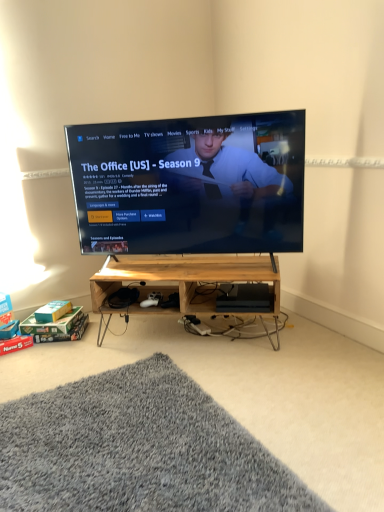
What do you see at coordinates (238, 297) in the screenshot? Image resolution: width=384 pixels, height=512 pixels. I see `wooden at center, positioned as the 2th shelf in bottom-to-top order` at bounding box center [238, 297].

Image resolution: width=384 pixels, height=512 pixels. I want to click on matte black tv at center, so pos(190,184).

What do you see at coordinates (193, 286) in the screenshot? I see `wooden at center, the 1th shelf when ordered from bottom to top` at bounding box center [193, 286].

This screenshot has height=512, width=384. I want to click on gray shaggy rug at lower left, so click(138, 449).

From a real-world perspective, which is physically below, gray shaggy rug at lower left or wooden at center, the 1th shelf when ordered from bottom to top?

→ gray shaggy rug at lower left.

Is gray shaggy rug at lower left thinner than wooden at center, placed as the second shelf when sorted from top to bottom?

Incorrect, the width of gray shaggy rug at lower left is not less than that of wooden at center, placed as the second shelf when sorted from top to bottom.

Which of these two, gray shaggy rug at lower left or wooden at center, the 1th shelf when ordered from bottom to top, is bigger?

wooden at center, the 1th shelf when ordered from bottom to top.

Which is more distant, (156, 401) or (233, 259)?

The point (233, 259) is farther from the camera.

From the image's perspective, is gray shaggy rug at lower left on wooden at center, the 1th shelf from the top?

No, from the image's perspective, gray shaggy rug at lower left is not above wooden at center, the 1th shelf from the top.

Is wooden at center, the 1th shelf from the top, at the back of gray shaggy rug at lower left?

No, wooden at center, the 1th shelf from the top, is not at the back of gray shaggy rug at lower left.

From a real-world perspective, is gray shaggy rug at lower left physically located above or below wooden at center, positioned as the 2th shelf in bottom-to-top order?

Clearly, from a real-world perspective, gray shaggy rug at lower left is below wooden at center, positioned as the 2th shelf in bottom-to-top order.

Which of these two, gray shaggy rug at lower left or wooden at center, the 1th shelf from the top, is wider?

Wider between the two is gray shaggy rug at lower left.

Which is nearer, (239, 304) or (162, 280)?

The point (239, 304) is more forward.

Is wooden at center, the 1th shelf from the top, bigger or smaller than wooden at center, the 1th shelf when ordered from bottom to top?

wooden at center, the 1th shelf from the top, is smaller than wooden at center, the 1th shelf when ordered from bottom to top.

In the scene shown: Is wooden at center, positioned as the 2th shelf in bottom-to-top order, directly adjacent to wooden at center, the 1th shelf when ordered from bottom to top?

wooden at center, positioned as the 2th shelf in bottom-to-top order, and wooden at center, the 1th shelf when ordered from bottom to top, are not in contact.

Based on their positions, is wooden at center, placed as the second shelf when sorted from top to bottom, located to the left or right of gray shaggy rug at lower left?

Clearly, wooden at center, placed as the second shelf when sorted from top to bottom, is on the right of gray shaggy rug at lower left in the image.

Is wooden at center, the 1th shelf when ordered from bottom to top, facing towards gray shaggy rug at lower left?

Yes, wooden at center, the 1th shelf when ordered from bottom to top, is facing gray shaggy rug at lower left.

Is wooden at center, the 1th shelf when ordered from bottom to top, directly adjacent to gray shaggy rug at lower left?

There is a gap between wooden at center, the 1th shelf when ordered from bottom to top, and gray shaggy rug at lower left.

From the matte black tv at center, count 1st shelf to the right and point to it. Please provide its 2D coordinates.

[(193, 286)]

Is wooden at center, the 1th shelf when ordered from bottom to top, looking in the opposite direction of matte black tv at center?

No.

Can you tell me how much wooden at center, placed as the second shelf when sorted from top to bottom, and matte black tv at center differ in facing direction?

The angular difference between wooden at center, placed as the second shelf when sorted from top to bottom, and matte black tv at center is 2.66e-05 degrees.

Is point (265, 260) closer or farther from the camera than point (161, 250)?

Point (265, 260) is positioned closer to the camera compared to point (161, 250).

In terms of size, does wooden at center, placed as the second shelf when sorted from top to bottom, appear bigger or smaller than wooden at center, positioned as the 2th shelf in bottom-to-top order?

wooden at center, placed as the second shelf when sorted from top to bottom, is bigger than wooden at center, positioned as the 2th shelf in bottom-to-top order.

Is the depth of wooden at center, placed as the second shelf when sorted from top to bottom, greater than that of wooden at center, positioned as the 2th shelf in bottom-to-top order?

No, it is not.

Is wooden at center, the 1th shelf when ordered from bottom to top, to the right of wooden at center, positioned as the 2th shelf in bottom-to-top order, from the viewer's perspective?

Incorrect, wooden at center, the 1th shelf when ordered from bottom to top, is not on the right side of wooden at center, positioned as the 2th shelf in bottom-to-top order.

Is wooden at center, the 1th shelf when ordered from bottom to top, touching wooden at center, positioned as the 2th shelf in bottom-to-top order?

No.

Looking at this image, does wooden at center, positioned as the 2th shelf in bottom-to-top order, appear on the left side of matte black tv at center?

Incorrect, wooden at center, positioned as the 2th shelf in bottom-to-top order, is not on the left side of matte black tv at center.

Is point (231, 285) closer to viewer compared to point (276, 152)?

No, it is not.

Between wooden at center, the 1th shelf from the top, and matte black tv at center, which one has more height?

With more height is matte black tv at center.

In the scene shown: Would you consider wooden at center, positioned as the 2th shelf in bottom-to-top order, to be distant from matte black tv at center?

No.

From a real-world perspective, count 1st shelfs upward from the gray shaggy rug at lower left and point to it. Please provide its 2D coordinates.

[(193, 286)]

Where is `mat directly beneath the wooden at center, positioned as the 2th shelf in bottom-to-top order (from a real-world perspective)`? mat directly beneath the wooden at center, positioned as the 2th shelf in bottom-to-top order (from a real-world perspective) is located at coordinates pyautogui.click(x=138, y=449).

Based on the photo, when comparing their distances from gray shaggy rug at lower left, does wooden at center, the 1th shelf from the top, or matte black tv at center seem further?

Based on the image, matte black tv at center appears to be further to gray shaggy rug at lower left.

Estimate the real-world distances between objects in this image. Which object is further from gray shaggy rug at lower left, matte black tv at center or wooden at center, placed as the second shelf when sorted from top to bottom?

matte black tv at center lies further to gray shaggy rug at lower left than the other object.

When comparing their distances from matte black tv at center, does gray shaggy rug at lower left or wooden at center, positioned as the 2th shelf in bottom-to-top order, seem closer?

wooden at center, positioned as the 2th shelf in bottom-to-top order, lies closer to matte black tv at center than the other object.

Considering their positions, is wooden at center, the 1th shelf when ordered from bottom to top, positioned further to gray shaggy rug at lower left than matte black tv at center?

matte black tv at center is positioned further to the anchor gray shaggy rug at lower left.

Considering their positions, is gray shaggy rug at lower left positioned closer to wooden at center, placed as the second shelf when sorted from top to bottom, than matte black tv at center?

Based on the image, matte black tv at center appears to be nearer to wooden at center, placed as the second shelf when sorted from top to bottom.

From the image, which object appears to be nearer to wooden at center, placed as the second shelf when sorted from top to bottom, matte black tv at center or gray shaggy rug at lower left?

matte black tv at center is positioned closer to the anchor wooden at center, placed as the second shelf when sorted from top to bottom.

Considering their positions, is wooden at center, the 1th shelf when ordered from bottom to top, positioned further to gray shaggy rug at lower left than wooden at center, positioned as the 2th shelf in bottom-to-top order?

wooden at center, positioned as the 2th shelf in bottom-to-top order, is positioned further to the anchor gray shaggy rug at lower left.

Estimate the real-world distances between objects in this image. Which object is closer to wooden at center, the 1th shelf from the top, wooden at center, the 1th shelf when ordered from bottom to top, or matte black tv at center?

wooden at center, the 1th shelf when ordered from bottom to top, is closer to wooden at center, the 1th shelf from the top.

The height and width of the screenshot is (512, 384). In order to click on shelf between gray shaggy rug at lower left and wooden at center, positioned as the 2th shelf in bottom-to-top order, from front to back in this screenshot , I will do `click(193, 286)`.

You are a GUI agent. You are given a task and a screenshot of the screen. Output one action in this format:
    pyautogui.click(x=<x>, y=<y>)
    Task: Click on the television between gray shaggy rug at lower left and wooden at center, the 1th shelf when ordered from bottom to top, from front to back
    The width and height of the screenshot is (384, 512).
    Given the screenshot: What is the action you would take?
    pyautogui.click(x=190, y=184)

Where is `television located between gray shaggy rug at lower left and wooden at center, positioned as the 2th shelf in bottom-to-top order, in the depth direction`? This screenshot has width=384, height=512. television located between gray shaggy rug at lower left and wooden at center, positioned as the 2th shelf in bottom-to-top order, in the depth direction is located at coordinates (190, 184).

Where is `shelf between matte black tv at center and wooden at center, the 1th shelf when ordered from bottom to top, vertically`? The width and height of the screenshot is (384, 512). shelf between matte black tv at center and wooden at center, the 1th shelf when ordered from bottom to top, vertically is located at coordinates (238, 297).